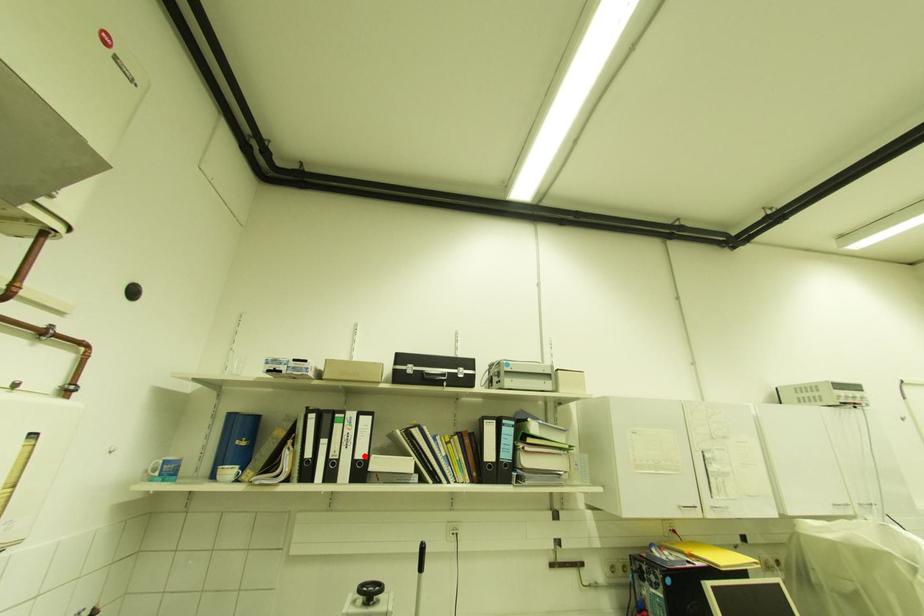
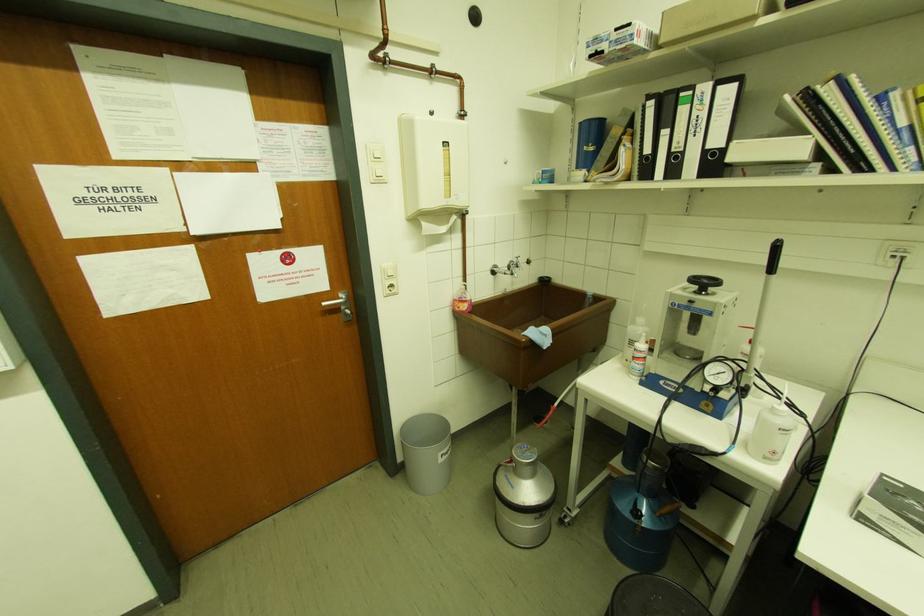
In the second image, find the point that corresponds to the highlighted location in the first image.

(720, 143)